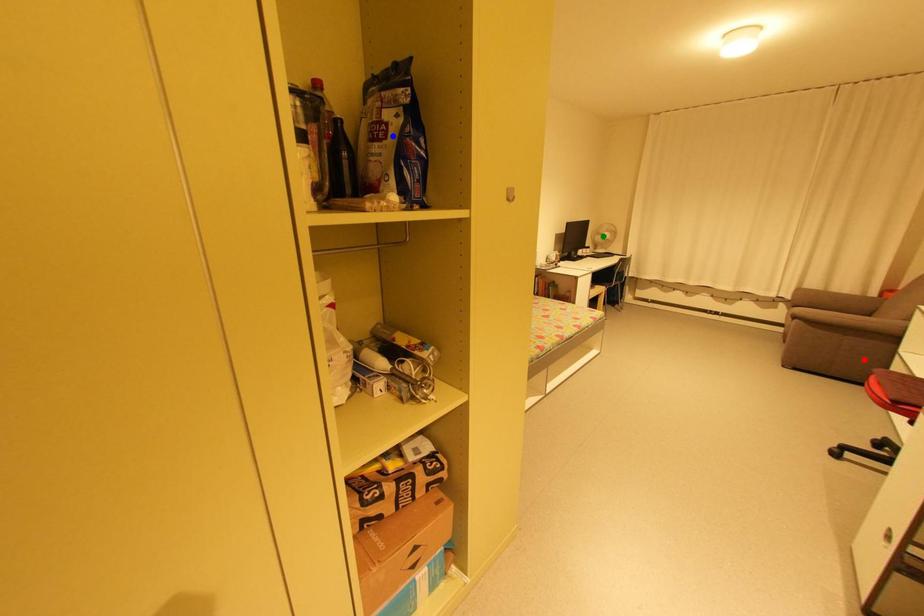
Order these from nearest to farthest:
1. red point
2. green point
3. blue point

blue point
red point
green point